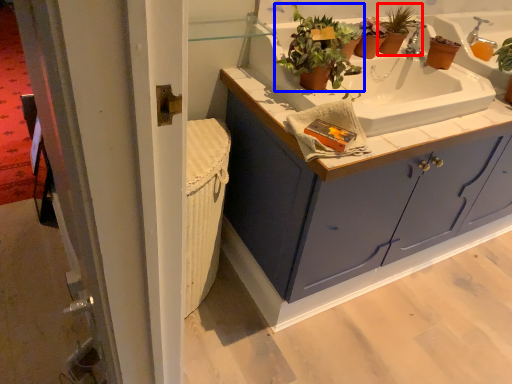
Question: Which point is closer to the camera, houseplant (highlighted by a red box) or houseplant (highlighted by a blue box)?

Choices:
 (A) houseplant
 (B) houseplant

Answer: (B)